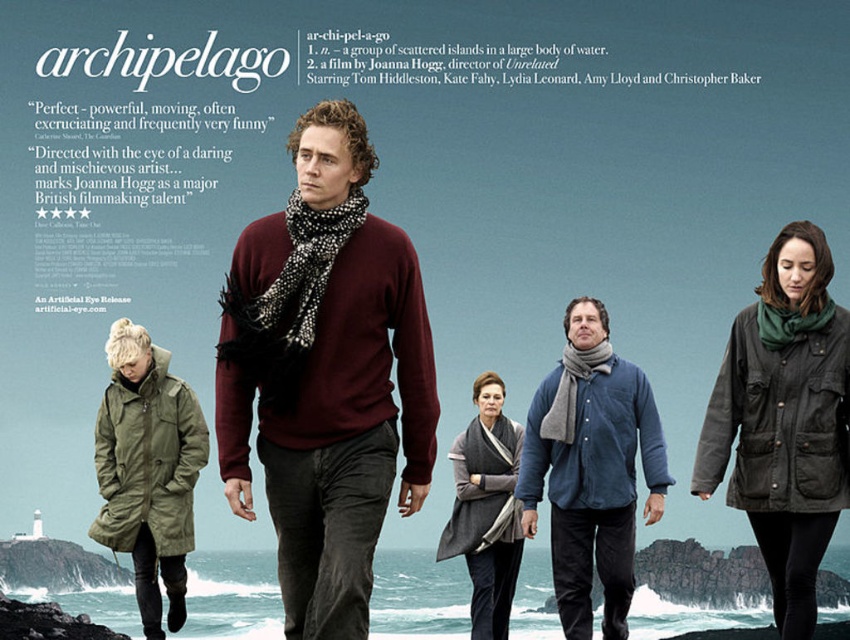
Question: Is maroon sweater at center positioned in front of olive-green parka at lower left?

Choices:
 (A) no
 (B) yes

Answer: (B)

Question: Does dark green waxed canvas jacket at lower right appear on the right side of gray wool scarf at center?

Choices:
 (A) no
 (B) yes

Answer: (B)

Question: Which of the following is the farthest from the observer?

Choices:
 (A) (817, 241)
 (B) (112, 452)
 (C) (367, 349)

Answer: (B)

Question: Which is farther from the olive-green parka at lower left?

Choices:
 (A) dark green waxed canvas jacket at lower right
 (B) gray wool scarf at center
 (C) maroon sweater at center
 (D) blue corduroy jacket at center

Answer: (A)

Question: Can you confirm if maroon sweater at center is wider than blue corduroy jacket at center?

Choices:
 (A) no
 (B) yes

Answer: (B)

Question: Which object is positioned closest to the maroon sweater at center?

Choices:
 (A) olive-green parka at lower left
 (B) blue corduroy jacket at center
 (C) dark green waxed canvas jacket at lower right

Answer: (A)